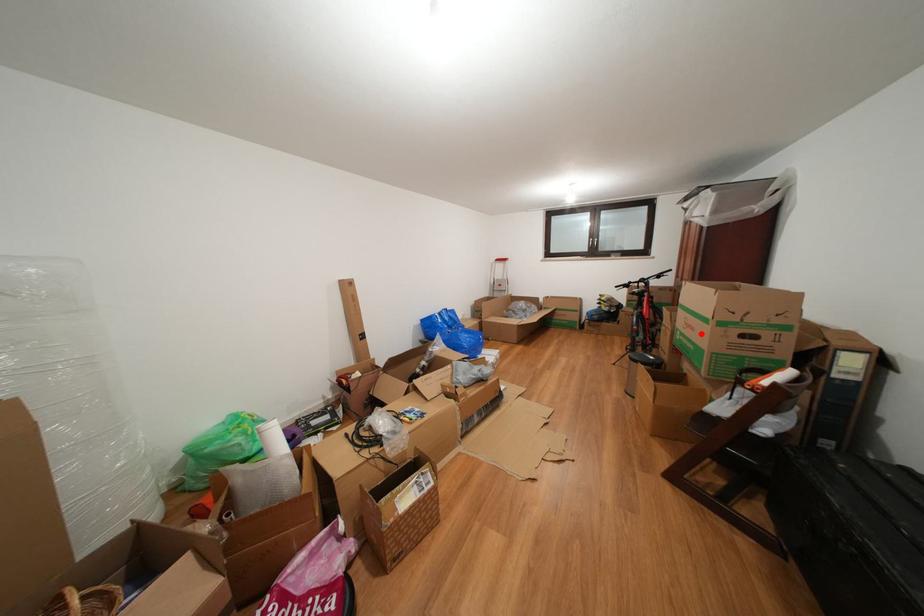
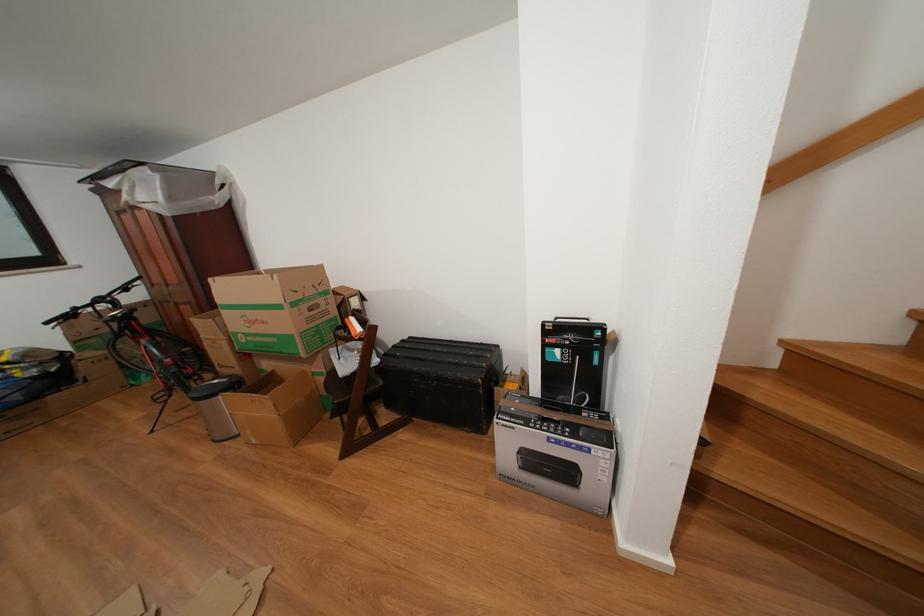
Question: I am providing you with two images of the same scene from different viewpoints. Given a red point in image1, look at the same physical point in image2. Is it:

Choices:
 (A) Closer to the viewpoint
 (B) Farther from the viewpoint

Answer: (B)